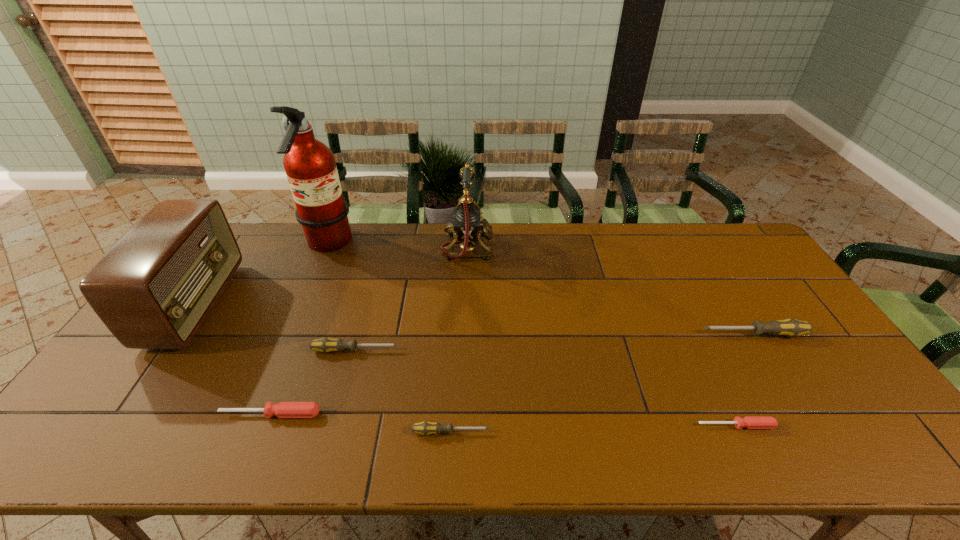
Find the location of a particular element. Image resolution: width=960 pixels, height=540 pixels. free region at the near edge of the desktop is located at coordinates (736, 441).

You are a GUI agent. You are given a task and a screenshot of the screen. Output one action in this format:
    pyautogui.click(x=<x>, y=<y>)
    Task: Click on the blank area at the left edge
    The width and height of the screenshot is (960, 540).
    Given the screenshot: What is the action you would take?
    tap(78, 421)

The height and width of the screenshot is (540, 960). What are the coordinates of `blank space at the right edge of the desktop` in the screenshot? It's located at (742, 265).

At what (x,y) coordinates should I click in order to perform the action: click on vacant space in between the telephone and the fourth shortest object. Please return your answer as a coordinate pair (x, y). Looking at the image, I should click on (412, 299).

Locate an element on the screen. The height and width of the screenshot is (540, 960). empty space that is in between the farther red screwdriver and the smallest gray screwdriver is located at coordinates (361, 423).

The width and height of the screenshot is (960, 540). Identify the location of free space that is in between the leftmost gray screwdriver and the telephone. (412, 299).

Locate an element on the screen. The width and height of the screenshot is (960, 540). free space between the tallest object and the rightmost gray screwdriver is located at coordinates (540, 290).

At what (x,y) coordinates should I click in order to perform the action: click on vacant space in between the nearest gray screwdriver and the biggest gray screwdriver. Please return your answer as a coordinate pair (x, y). This screenshot has width=960, height=540. Looking at the image, I should click on (602, 383).

Where is `free spot between the radio receiver and the tallest object`? This screenshot has width=960, height=540. free spot between the radio receiver and the tallest object is located at coordinates (261, 275).

You are a GUI agent. You are given a task and a screenshot of the screen. Output one action in this format:
    pyautogui.click(x=<x>, y=<y>)
    Task: Click on the unoccupied position between the shortest object and the farthest screwdriver
    
    Given the screenshot: What is the action you would take?
    pyautogui.click(x=745, y=380)